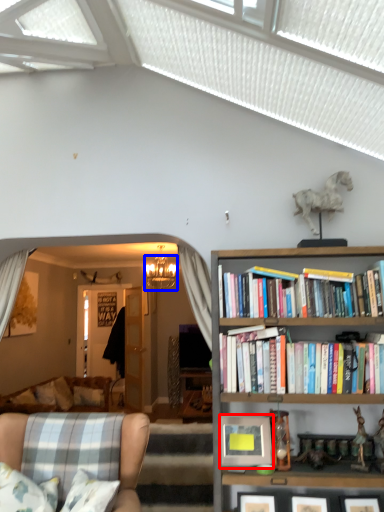
Question: Which object appears farthest to the camera in this image, picture frame (highlighted by a red box) or lamp (highlighted by a blue box)?

Choices:
 (A) picture frame
 (B) lamp

Answer: (B)